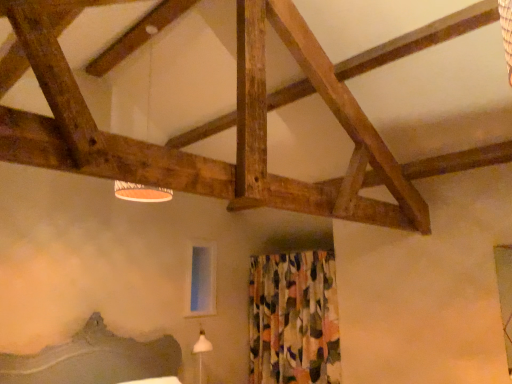
Identify the location of transparent glass window screen at center. (201, 280).

What is the approximate width of white fabric lampshade at upper center?

white fabric lampshade at upper center is 16.93 inches wide.

This screenshot has height=384, width=512. I want to click on floral fabric curtain at center, so click(x=294, y=319).

Describe the element at coordinates (294, 319) in the screenshot. This screenshot has height=384, width=512. I see `floral fabric curtain at center` at that location.

Find the location of a particular element. Image resolution: width=512 pixels, height=384 pixels. transparent glass window screen at center is located at coordinates (201, 280).

Is floral fabric curtain at center surrounding transparent glass window screen at center?

No, transparent glass window screen at center is not inside floral fabric curtain at center.

Which of these two, floral fabric curtain at center or transparent glass window screen at center, is wider?

floral fabric curtain at center is wider.

Which of these two, floral fabric curtain at center or transparent glass window screen at center, stands shorter?

transparent glass window screen at center.

Consider the image. Are transparent glass window screen at center and white fabric lampshade at upper center making contact?

No, transparent glass window screen at center is not beside white fabric lampshade at upper center.

From the image's perspective, who appears lower, transparent glass window screen at center or white fabric lampshade at upper center?

transparent glass window screen at center is shown below in the image.

From a real-world perspective, is transparent glass window screen at center over white fabric lampshade at upper center?

No, from a real-world perspective, transparent glass window screen at center is not above white fabric lampshade at upper center.

Is transparent glass window screen at center aimed at white fabric lampshade at upper center?

No.

From the image's perspective, which is above, floral fabric curtain at center or white fabric lampshade at upper center?

white fabric lampshade at upper center appears higher in the image.

Can you confirm if floral fabric curtain at center is wider than white fabric lampshade at upper center?

No.

Considering the positions of objects floral fabric curtain at center and white fabric lampshade at upper center in the image provided, who is more to the right, floral fabric curtain at center or white fabric lampshade at upper center?

From the viewer's perspective, floral fabric curtain at center appears more on the right side.

This screenshot has width=512, height=384. I want to click on lamp above the floral fabric curtain at center (from the image's perspective), so click(141, 192).

Is point (207, 248) closer to viewer compared to point (296, 367)?

No, (207, 248) is behind (296, 367).

Is transparent glass window screen at center placed right next to floral fabric curtain at center?

transparent glass window screen at center is not next to floral fabric curtain at center, and they're not touching.

Where is `window screen above the floral fabric curtain at center (from the image's perspective)`? The width and height of the screenshot is (512, 384). window screen above the floral fabric curtain at center (from the image's perspective) is located at coordinates point(201,280).

How different are the orientations of white fabric lampshade at upper center and floral fabric curtain at center in degrees?

87.9 degrees separate the facing orientations of white fabric lampshade at upper center and floral fabric curtain at center.

From a real-world perspective, which is physically below, white fabric lampshade at upper center or floral fabric curtain at center?

floral fabric curtain at center, from a real-world perspective.

Does white fabric lampshade at upper center have a larger size compared to floral fabric curtain at center?

Actually, white fabric lampshade at upper center might be smaller than floral fabric curtain at center.

Is there a large distance between white fabric lampshade at upper center and floral fabric curtain at center?

white fabric lampshade at upper center is far away from floral fabric curtain at center.

Considering the relative sizes of white fabric lampshade at upper center and transparent glass window screen at center in the image provided, is white fabric lampshade at upper center wider than transparent glass window screen at center?

Correct, the width of white fabric lampshade at upper center exceeds that of transparent glass window screen at center.

In terms of size, does white fabric lampshade at upper center appear bigger or smaller than transparent glass window screen at center?

Considering their sizes, white fabric lampshade at upper center takes up more space than transparent glass window screen at center.

Looking at this image, can you confirm if white fabric lampshade at upper center is taller than transparent glass window screen at center?

Yes.

Identify the location of lamp that appears above the transparent glass window screen at center (from a real-world perspective). (141, 192).

This screenshot has height=384, width=512. I want to click on curtain that appears below the transparent glass window screen at center (from a real-world perspective), so click(294, 319).

Image resolution: width=512 pixels, height=384 pixels. In order to click on window screen on the right side of white fabric lampshade at upper center in this screenshot , I will do `click(201, 280)`.

From the image, which object appears to be farther from transparent glass window screen at center, floral fabric curtain at center or white fabric lampshade at upper center?

Among the two, white fabric lampshade at upper center is located further to transparent glass window screen at center.

Based on their spatial positions, is floral fabric curtain at center or transparent glass window screen at center closer to white fabric lampshade at upper center?

Based on the image, transparent glass window screen at center appears to be nearer to white fabric lampshade at upper center.

Looking at the image, which one is located further to white fabric lampshade at upper center, transparent glass window screen at center or floral fabric curtain at center?

Among the two, floral fabric curtain at center is located further to white fabric lampshade at upper center.

Estimate the real-world distances between objects in this image. Which object is further from floral fabric curtain at center, transparent glass window screen at center or white fabric lampshade at upper center?

The object further to floral fabric curtain at center is white fabric lampshade at upper center.

From the picture: When comparing their distances from transparent glass window screen at center, does white fabric lampshade at upper center or floral fabric curtain at center seem further?

Based on the image, white fabric lampshade at upper center appears to be further to transparent glass window screen at center.

When comparing their distances from floral fabric curtain at center, does white fabric lampshade at upper center or transparent glass window screen at center seem closer?

Among the two, transparent glass window screen at center is located nearer to floral fabric curtain at center.

At what (x,y) coordinates should I click in order to perform the action: click on window screen between white fabric lampshade at upper center and floral fabric curtain at center in the up-down direction. Please return your answer as a coordinate pair (x, y). Looking at the image, I should click on (201, 280).